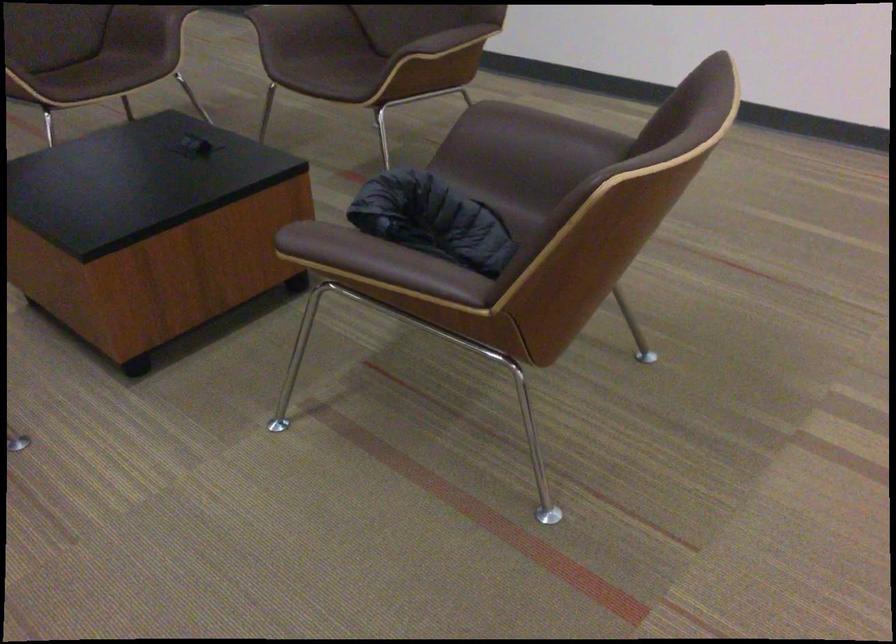
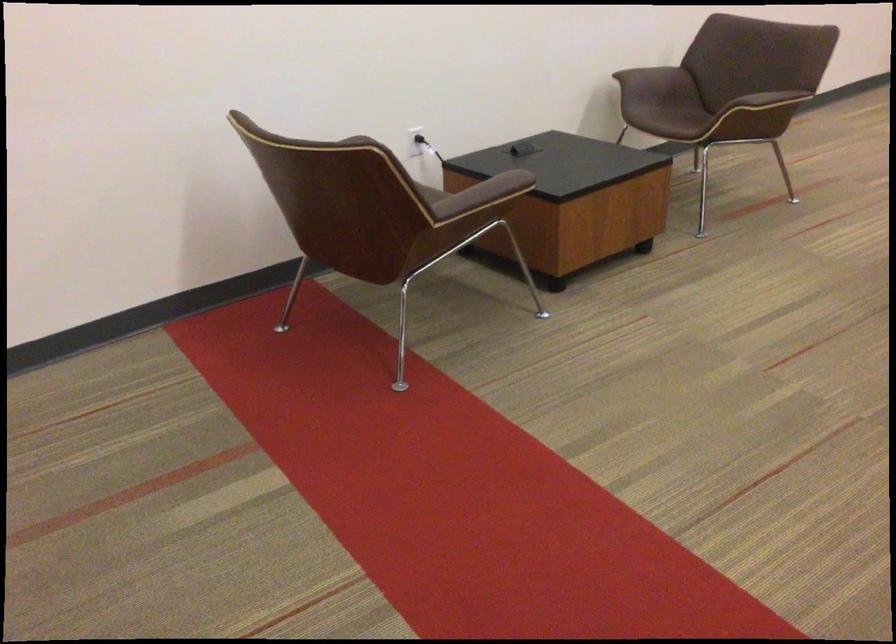
Question: The first image is from the beginning of the video and the second image is from the end. How did the camera likely rotate when shooting the video?

Choices:
 (A) Left
 (B) Right
 (C) Up
 (D) Down

Answer: (B)